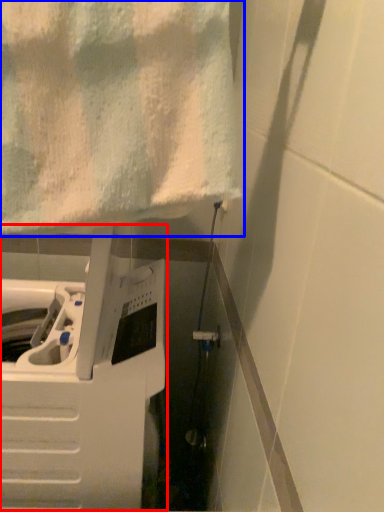
Question: Among these objects, which one is nearest to the camera, appliance (highlighted by a red box) or towel (highlighted by a blue box)?

Choices:
 (A) appliance
 (B) towel

Answer: (B)